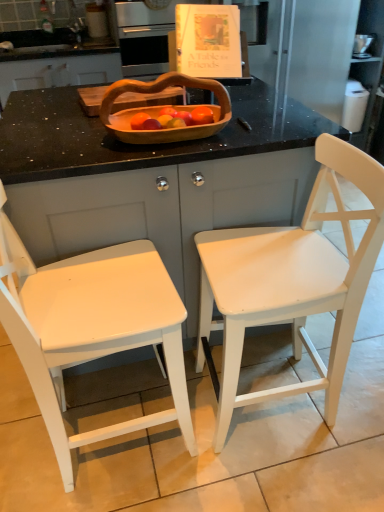
Where is `free spot to the left of white painted wood chair at left, which ranks as the 2th chair in right-to-left order`? free spot to the left of white painted wood chair at left, which ranks as the 2th chair in right-to-left order is located at coordinates (32, 443).